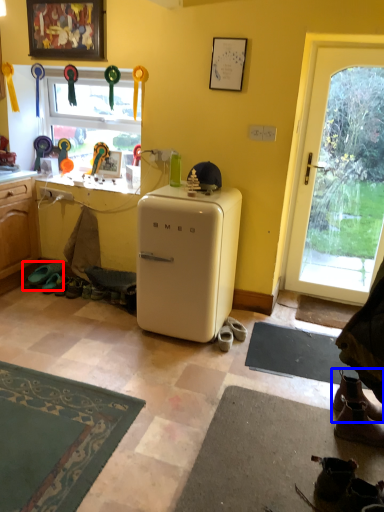
Question: Which point is closer to the camera, footwear (highlighted by a red box) or footwear (highlighted by a blue box)?

Choices:
 (A) footwear
 (B) footwear

Answer: (B)